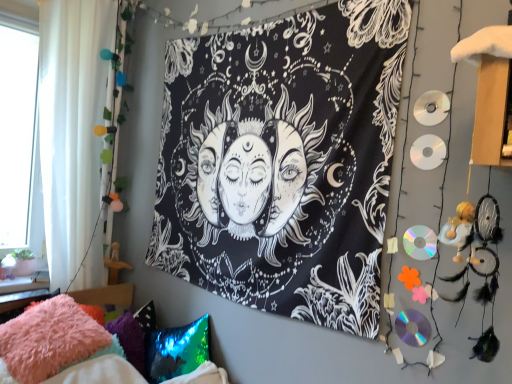
At what (x,y) coordinates should I click in order to perform the action: click on free space above black fabric tapestry at center (from a real-world perspective). Please return your answer as a coordinate pair (x, y). This screenshot has height=384, width=512. Looking at the image, I should click on (230, 19).